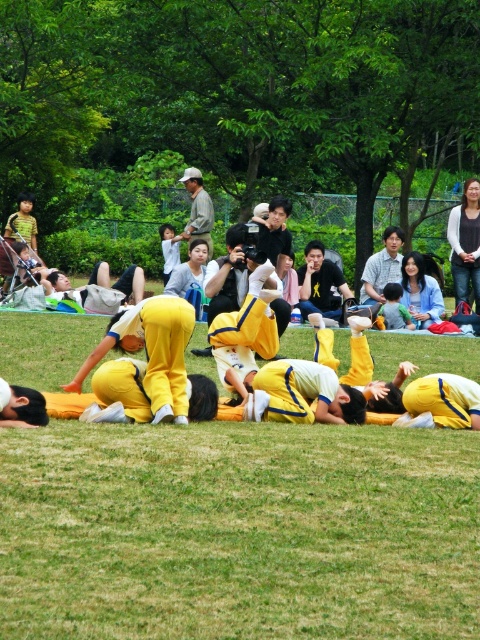
Question: Among these objects, which one is farthest from the camera?

Choices:
 (A) black matte shirt at center
 (B) green grass at center
 (C) black cotton shirt at upper right

Answer: (C)

Question: In this image, where is black cotton shirt at upper right located relative to light gray shirt at upper center?

Choices:
 (A) left
 (B) right

Answer: (B)

Question: Which object appears closest to the camera in this image?

Choices:
 (A) black matte shirt at center
 (B) green grass at center
 (C) black cotton shirt at upper right

Answer: (B)

Question: Which point is closer to the camera?

Choices:
 (A) (208, 243)
 (B) (373, 285)
 (C) (108, 625)

Answer: (C)

Question: Does green grass at center appear over light gray shirt at upper center?

Choices:
 (A) yes
 (B) no

Answer: (B)

Question: Does green grass at center appear under light gray shirt at upper center?

Choices:
 (A) yes
 (B) no

Answer: (A)